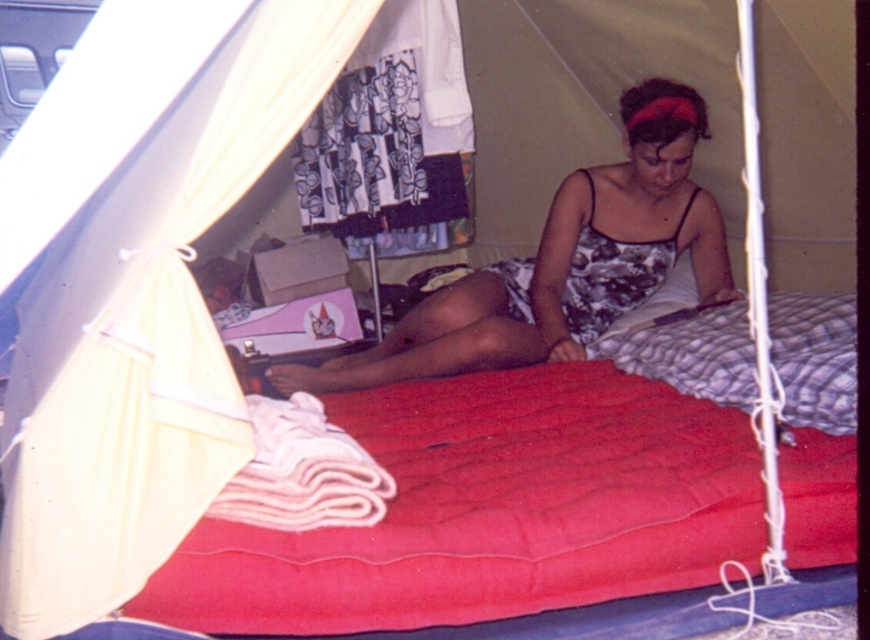
You are setting up a camping tent and need to place a backpack between the red quilted mattress at center and the printed fabric dress at center. Based on their positions, which side of the mattress should you place the backpack to ensure it is between them?

The red quilted mattress at center is to the left of the printed fabric dress at center, so placing the backpack to the right side of the mattress would position it between them.